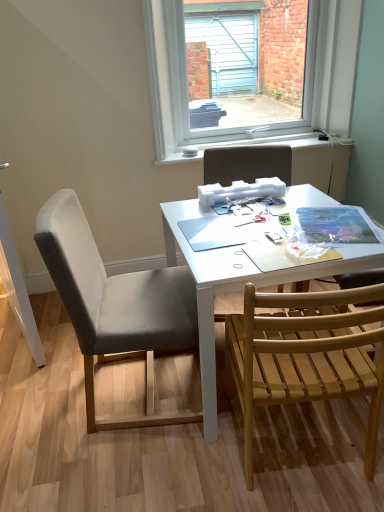
Question: Is gray fabric chair at center, positioned as the second chair in left-to-right order, beside white matte table at center?

Choices:
 (A) yes
 (B) no

Answer: (B)

Question: Could you tell me if gray fabric chair at center, positioned as the second chair in left-to-right order, is facing white matte table at center?

Choices:
 (A) no
 (B) yes

Answer: (B)

Question: Can you confirm if gray fabric chair at center, acting as the second chair starting from the right, is taller than white matte table at center?

Choices:
 (A) yes
 (B) no

Answer: (B)

Question: From the image's perspective, is gray fabric chair at center, acting as the second chair starting from the right, beneath white matte table at center?

Choices:
 (A) no
 (B) yes

Answer: (A)

Question: Considering the relative sizes of gray fabric chair at center, positioned as the second chair in left-to-right order, and white matte table at center in the image provided, is gray fabric chair at center, positioned as the second chair in left-to-right order, wider than white matte table at center?

Choices:
 (A) no
 (B) yes

Answer: (A)

Question: Does gray fabric chair at center, positioned as the second chair in left-to-right order, have a lesser height compared to white matte table at center?

Choices:
 (A) yes
 (B) no

Answer: (A)

Question: Is gray fabric chair at left, the third chair viewed from the right, placed right next to clear glass window at upper center?

Choices:
 (A) yes
 (B) no

Answer: (B)

Question: Is gray fabric chair at left, acting as the first chair starting from the left, taller than clear glass window at upper center?

Choices:
 (A) no
 (B) yes

Answer: (B)

Question: Does gray fabric chair at left, acting as the first chair starting from the left, lie behind clear glass window at upper center?

Choices:
 (A) no
 (B) yes

Answer: (A)

Question: From a real-world perspective, is gray fabric chair at left, the third chair viewed from the right, beneath clear glass window at upper center?

Choices:
 (A) yes
 (B) no

Answer: (A)

Question: Is gray fabric chair at left, the third chair viewed from the right, thinner than clear glass window at upper center?

Choices:
 (A) yes
 (B) no

Answer: (B)

Question: From the image's perspective, is gray fabric chair at center, acting as the second chair starting from the right, below gray fabric chair at left, acting as the first chair starting from the left?

Choices:
 (A) yes
 (B) no

Answer: (B)